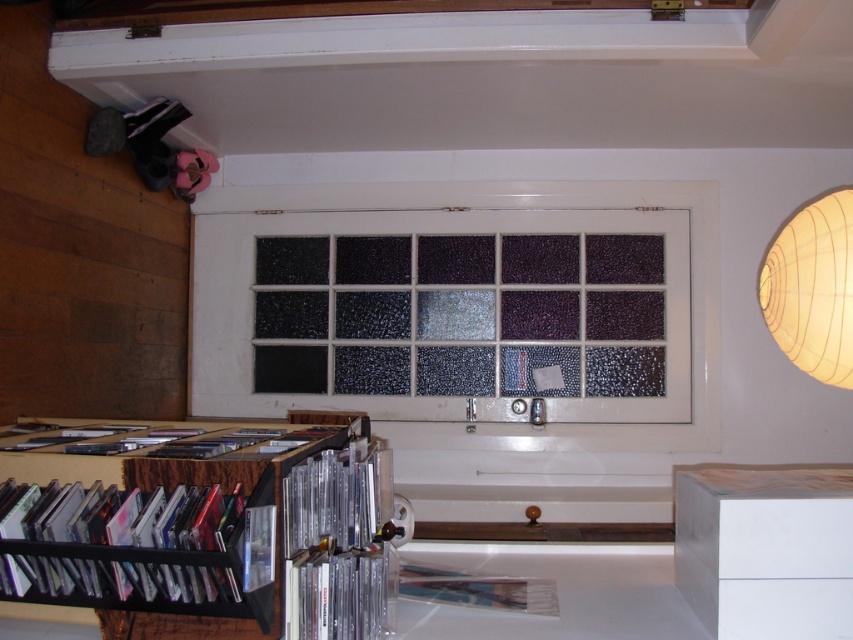
Question: Does clear plastic cd cases at lower left have a smaller size compared to black plastic cd case at lower left?

Choices:
 (A) yes
 (B) no

Answer: (B)

Question: Which object appears closest to the camera in this image?

Choices:
 (A) black plastic bookshelf at lower left
 (B) clear plastic cd cases at lower left
 (C) translucent glass window at center
 (D) black plastic cd case at lower left

Answer: (A)

Question: Among these objects, which one is nearest to the camera?

Choices:
 (A) black plastic bookshelf at lower left
 (B) clear plastic cd cases at lower left
 (C) translucent glass window at center

Answer: (A)

Question: Does black plastic bookshelf at lower left appear under metallic silver book at center?

Choices:
 (A) yes
 (B) no

Answer: (B)

Question: Among these points, which one is nearest to the camera?

Choices:
 (A) (103, 588)
 (B) (619, 337)
 (C) (488, 593)
 (D) (357, 524)

Answer: (A)

Question: Does translucent glass window at center appear over black plastic bookshelf at lower left?

Choices:
 (A) yes
 (B) no

Answer: (A)